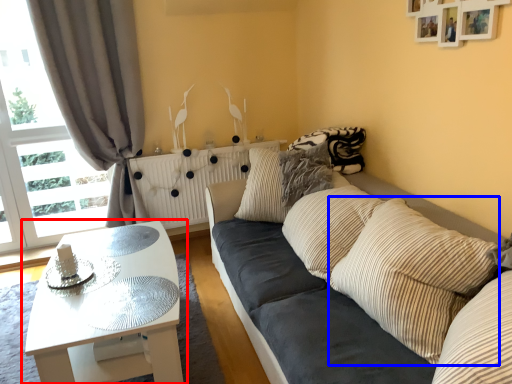
Question: Which point is further to the camera, coffee table (highlighted by a red box) or pillow (highlighted by a blue box)?

Choices:
 (A) coffee table
 (B) pillow

Answer: (A)